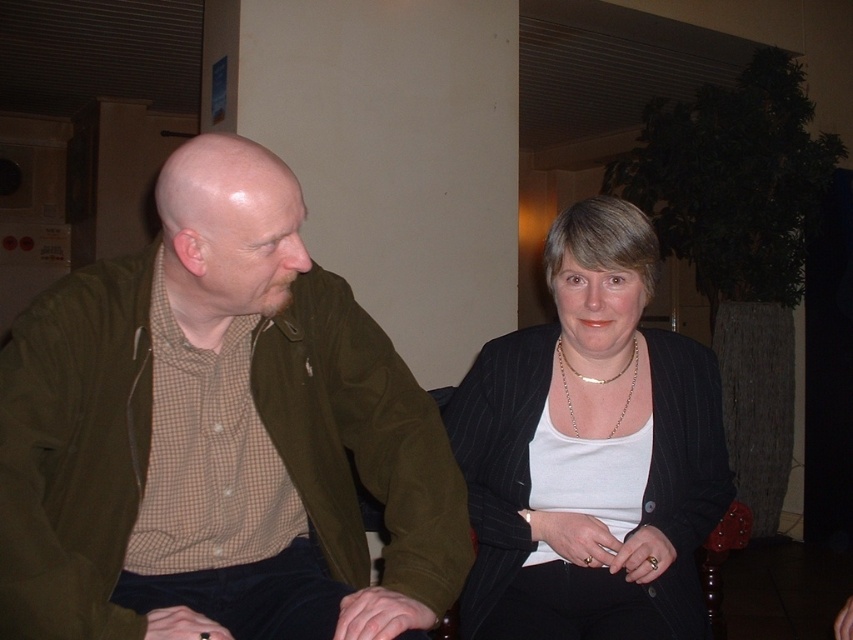
You are a fashion designer observing two people in a room. You notice the white pinstripe blazer at center and the gold chain necklace at center. Which clothing item is positioned to the right of the other?

The white pinstripe blazer at center is to the right of the gold chain necklace at center.

You are standing in the room where the two individuals are seated. You need to place a small plant on the table between them. The plant must be placed closer to the person wearing the matte olive green jacket at left. Based on their positions, where should you place the plant?

The matte olive green jacket at left is located at point 0.683 on the horizontal axis and 0.256 on the vertical axis. To place the plant closer to this jacket, position it nearer to the coordinates corresponding to the left individual.

From the picture: You are a fashion designer observing the scene. You need to determine the spatial relationship between the matte olive green jacket at left and the gold chain necklace at center. Which object is positioned lower in the image?

The matte olive green jacket at left is located below the gold chain necklace at center, so the matte olive green jacket at left is positioned lower in the image.